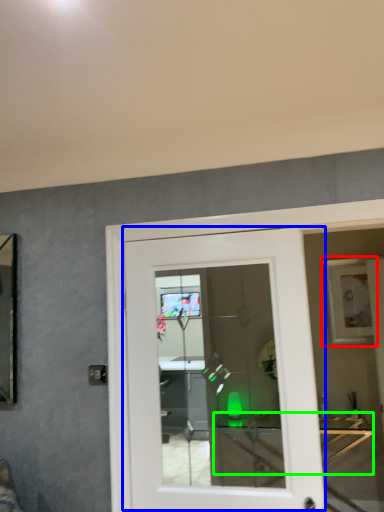
Question: Which object is the closest to the picture frame (highlighted by a red box)? Choose among these: door (highlighted by a blue box) or table (highlighted by a green box).

Choices:
 (A) door
 (B) table

Answer: (B)